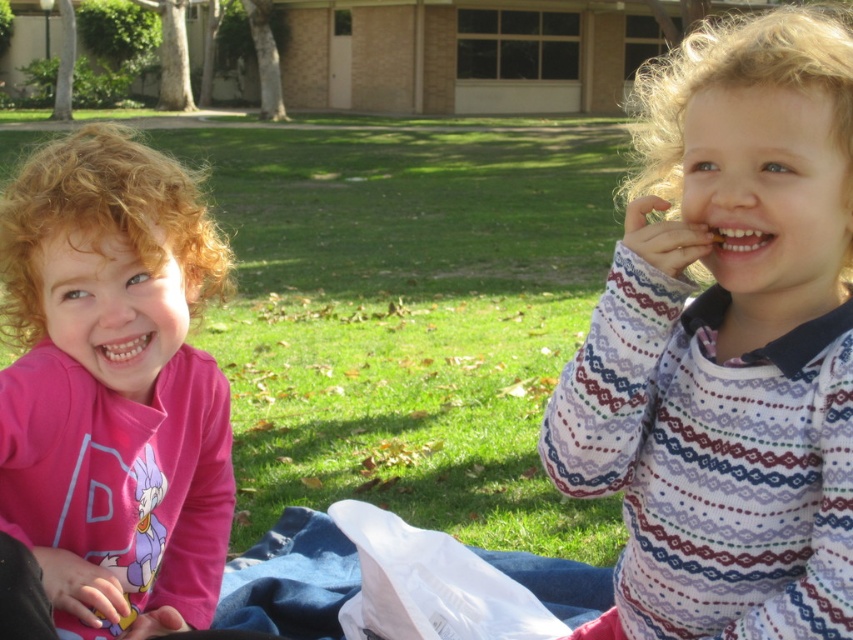
You are a fashion designer observing two children playing outside. You notice the white knit sweater at right and the pink matte shirt at left. Which clothing item has a narrower width?

The white knit sweater at right is thinner than the pink matte shirt at left, so the white knit sweater at right has a narrower width.

You are a delivery robot with a box that is 1.5 meters long. You need to place the box between yourself and the white knit sweater at right. Is there enough space to fit the box without it overlapping with the sweater?

The distance between the white knit sweater at right and the viewer is 1.59 meters. Since the box is 1.5 meters long, there is enough space to place it between you and the sweater without overlapping.

You are a photographer trying to capture a photo of both the white knit sweater at right and the pink matte shirt at left. Based on their positions, which direction should you move to frame both in the shot?

Since the white knit sweater at right is to the right of the pink matte shirt at left, you should move to the left to ensure both are in frame.